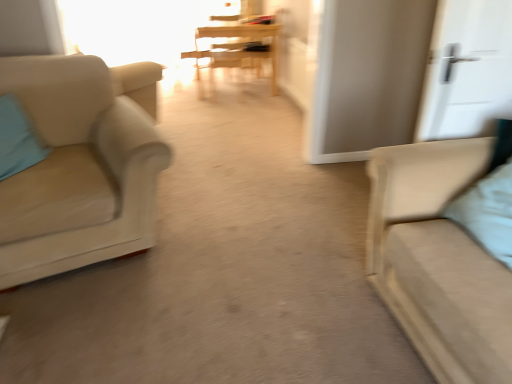
What do you see at coordinates (488, 212) in the screenshot? I see `light blue fabric pillow at right, the 1th pillow from the front` at bounding box center [488, 212].

What is the approximate width of light blue fabric pillow at right, the 1th pillow from the front?

light blue fabric pillow at right, the 1th pillow from the front, is 14.29 inches in width.

This screenshot has width=512, height=384. Describe the element at coordinates (234, 47) in the screenshot. I see `wooden armchair at center` at that location.

What is the approximate width of wooden armchair at center?

wooden armchair at center is 20.40 inches in width.

Identify the location of beige fabric chair at left. (81, 165).

Where is `light blue fabric pillow at left, which is the second pillow in right-to-left order`? light blue fabric pillow at left, which is the second pillow in right-to-left order is located at coordinates (17, 139).

Who is more distant, light blue fabric pillow at left, which is the second pillow in right-to-left order, or light blue fabric pillow at right, arranged as the second pillow when viewed from the back?

light blue fabric pillow at left, which is the second pillow in right-to-left order, is more distant.

Is light blue fabric pillow at left, which ranks as the 1th pillow in back-to-front order, thinner than light blue fabric pillow at right, the 1th pillow from the front?

Correct, the width of light blue fabric pillow at left, which ranks as the 1th pillow in back-to-front order, is less than that of light blue fabric pillow at right, the 1th pillow from the front.

Choose the correct answer: Is light blue fabric pillow at left, which is the second pillow in right-to-left order, inside light blue fabric pillow at right, which is the 1th pillow in right-to-left order, or outside it?

The correct answer is: outside.

Which is in front, point (262, 28) or point (19, 129)?

Positioned in front is point (19, 129).

From the image's perspective, is wooden table at center positioned above or below light blue fabric pillow at left, which is the second pillow in right-to-left order?

Clearly, from the image's perspective, wooden table at center is above light blue fabric pillow at left, which is the second pillow in right-to-left order.

In the scene shown: Is light blue fabric pillow at left, which is the second pillow in front-to-back order, a part of wooden table at center?

No, light blue fabric pillow at left, which is the second pillow in front-to-back order, is not inside wooden table at center.

Considering the relative sizes of wooden table at center and light blue fabric pillow at left, which is the second pillow in right-to-left order, in the image provided, is wooden table at center shorter than light blue fabric pillow at left, which is the second pillow in right-to-left order,?

In fact, wooden table at center may be taller than light blue fabric pillow at left, which is the second pillow in right-to-left order.

Can you confirm if light blue fabric pillow at right, arranged as the second pillow when viewed from the back, is bigger than light blue fabric pillow at left, which ranks as the 1th pillow in back-to-front order?

Yes, light blue fabric pillow at right, arranged as the second pillow when viewed from the back, is bigger than light blue fabric pillow at left, which ranks as the 1th pillow in back-to-front order.

From a real-world perspective, is light blue fabric pillow at right, the second pillow from the left, above or below light blue fabric pillow at left, which appears as the first pillow when viewed from the left?

light blue fabric pillow at right, the second pillow from the left, is situated higher than light blue fabric pillow at left, which appears as the first pillow when viewed from the left, in the real world.

How far apart are light blue fabric pillow at right, which is the 1th pillow in right-to-left order, and light blue fabric pillow at left, which appears as the first pillow when viewed from the left?

light blue fabric pillow at right, which is the 1th pillow in right-to-left order, is 1.98 meters away from light blue fabric pillow at left, which appears as the first pillow when viewed from the left.

Is light blue fabric pillow at right, the 1th pillow from the front, in front of or behind light blue fabric pillow at left, which is the second pillow in front-to-back order, in the image?

Visually, light blue fabric pillow at right, the 1th pillow from the front, is located in front of light blue fabric pillow at left, which is the second pillow in front-to-back order.

Which is less distant, (4, 165) or (252, 41)?

Clearly, point (4, 165) is closer to the camera than point (252, 41).

Is light blue fabric pillow at left, which appears as the first pillow when viewed from the left, oriented away from wooden armchair at center?

light blue fabric pillow at left, which appears as the first pillow when viewed from the left, is not turned away from wooden armchair at center.

Is light blue fabric pillow at left, which appears as the first pillow when viewed from the left, positioned in front of wooden armchair at center?

Yes, it is.

In the image, is light blue fabric pillow at left, which ranks as the 1th pillow in back-to-front order, on the left side or the right side of wooden armchair at center?

From the image, it's evident that light blue fabric pillow at left, which ranks as the 1th pillow in back-to-front order, is to the left of wooden armchair at center.

Is white matte door at upper right positioned behind light blue fabric pillow at right, arranged as the second pillow when viewed from the back?

Yes, the depth of white matte door at upper right is greater than that of light blue fabric pillow at right, arranged as the second pillow when viewed from the back.

Can you confirm if white matte door at upper right is positioned to the left of light blue fabric pillow at right, which is the 1th pillow in right-to-left order?

In fact, white matte door at upper right is to the right of light blue fabric pillow at right, which is the 1th pillow in right-to-left order.

Looking at the image, does wooden table at center seem bigger or smaller compared to light blue fabric pillow at right, the 1th pillow from the front?

Clearly, wooden table at center is larger in size than light blue fabric pillow at right, the 1th pillow from the front.

Does wooden table at center have a greater width compared to light blue fabric pillow at right, arranged as the second pillow when viewed from the back?

Yes, wooden table at center is wider than light blue fabric pillow at right, arranged as the second pillow when viewed from the back.

Is light blue fabric pillow at right, arranged as the second pillow when viewed from the back, completely or partially inside wooden table at center?

No, light blue fabric pillow at right, arranged as the second pillow when viewed from the back, is not a part of wooden table at center.

Looking at this image, in terms of height, does wooden table at center look taller or shorter compared to light blue fabric pillow at right, which is the 1th pillow in right-to-left order?

Considering their sizes, wooden table at center has more height than light blue fabric pillow at right, which is the 1th pillow in right-to-left order.

What's the angular difference between beige fabric chair at left and light blue fabric pillow at left, which is the second pillow in front-to-back order,'s facing directions?

There is a 34.6-degree angle between the facing directions of beige fabric chair at left and light blue fabric pillow at left, which is the second pillow in front-to-back order.

Can you confirm if beige fabric chair at left is smaller than light blue fabric pillow at left, which is the second pillow in right-to-left order?

No, beige fabric chair at left is not smaller than light blue fabric pillow at left, which is the second pillow in right-to-left order.

Consider the image. From the image's perspective, which is above, beige fabric chair at left or light blue fabric pillow at left, which appears as the first pillow when viewed from the left?

From the image's view, light blue fabric pillow at left, which appears as the first pillow when viewed from the left, is above.

This screenshot has height=384, width=512. In order to click on chair in front of the light blue fabric pillow at left, which is the second pillow in right-to-left order in this screenshot , I will do `click(81, 165)`.

In order to click on pillow above the light blue fabric pillow at right, the second pillow from the left (from the image's perspective) in this screenshot , I will do `click(17, 139)`.

From the image's perspective, count 1st pillows downward from the wooden table at center and point to it. Please provide its 2D coordinates.

[(17, 139)]

Based on their spatial positions, is matte beige couch at right or white matte door at upper right closer to beige fabric chair at left?

Based on the image, matte beige couch at right appears to be nearer to beige fabric chair at left.

Considering their positions, is transparent glass window at upper center positioned further to beige fabric chair at left than white matte door at upper right?

transparent glass window at upper center lies further to beige fabric chair at left than the other object.

Considering their positions, is matte beige couch at right positioned closer to light blue fabric pillow at right, which is the 1th pillow in right-to-left order, than transparent glass window at upper center?

matte beige couch at right is positioned closer to the anchor light blue fabric pillow at right, which is the 1th pillow in right-to-left order.

In the scene shown: Which object lies further to the anchor point light blue fabric pillow at left, which is the second pillow in right-to-left order, beige fabric chair at left or wooden armchair at center?

wooden armchair at center lies further to light blue fabric pillow at left, which is the second pillow in right-to-left order, than the other object.

Estimate the real-world distances between objects in this image. Which object is further from beige fabric chair at left, wooden table at center or matte beige couch at right?

Among the two, wooden table at center is located further to beige fabric chair at left.

Estimate the real-world distances between objects in this image. Which object is closer to light blue fabric pillow at left, which is the second pillow in right-to-left order, transparent glass window at upper center or wooden armchair at center?

wooden armchair at center is closer to light blue fabric pillow at left, which is the second pillow in right-to-left order.

Estimate the real-world distances between objects in this image. Which object is closer to light blue fabric pillow at right, arranged as the second pillow when viewed from the back, light blue fabric pillow at left, which ranks as the 1th pillow in back-to-front order, or wooden armchair at center?

light blue fabric pillow at left, which ranks as the 1th pillow in back-to-front order, is closer to light blue fabric pillow at right, arranged as the second pillow when viewed from the back.

Looking at the image, which one is located further to transparent glass window at upper center, light blue fabric pillow at left, which is the second pillow in front-to-back order, or matte beige couch at right?

matte beige couch at right lies further to transparent glass window at upper center than the other object.

Locate an element on the screen. This screenshot has height=384, width=512. chair between light blue fabric pillow at left, which is the second pillow in front-to-back order, and matte beige couch at right from left to right is located at coordinates (81, 165).

You are a GUI agent. You are given a task and a screenshot of the screen. Output one action in this format:
    pyautogui.click(x=<x>, y=<y>)
    Task: Click on the armchair located between beige fabric chair at left and transparent glass window at upper center in the depth direction
    The height and width of the screenshot is (384, 512).
    Given the screenshot: What is the action you would take?
    pyautogui.click(x=234, y=47)

At what (x,y) coordinates should I click in order to perform the action: click on door between beige fabric chair at left and transparent glass window at upper center in the front-back direction. Please return your answer as a coordinate pair (x, y). Looking at the image, I should click on (467, 69).

Image resolution: width=512 pixels, height=384 pixels. Identify the location of table between light blue fabric pillow at left, which is the second pillow in right-to-left order, and wooden armchair at center in the front-back direction. click(240, 47).